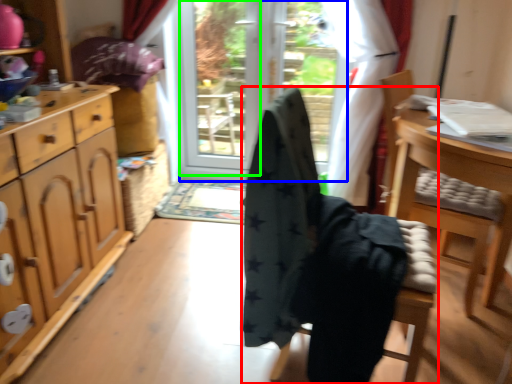
Question: Which is farther away from chair (highlighted by a red box)? screen door (highlighted by a blue box) or screen door (highlighted by a green box)?

Choices:
 (A) screen door
 (B) screen door

Answer: (B)